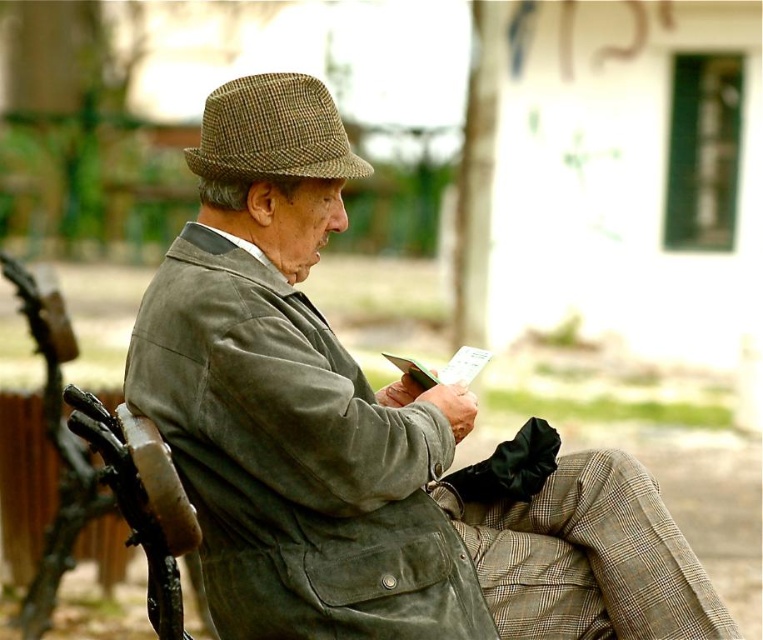
Question: Does matte green coat at center have a smaller size compared to brown checkered fedora at upper center?

Choices:
 (A) yes
 (B) no

Answer: (B)

Question: Where is matte green coat at center located in relation to brown checkered fedora at upper center in the image?

Choices:
 (A) left
 (B) right

Answer: (B)

Question: Which object is closer to the camera taking this photo?

Choices:
 (A) matte green coat at center
 (B) green corduroy trench coat at center
 (C) brown checkered fedora at upper center

Answer: (B)

Question: Which object is positioned closest to the brown checkered fedora at upper center?

Choices:
 (A) green corduroy trench coat at center
 (B) matte green coat at center

Answer: (A)

Question: Can you confirm if matte green coat at center is positioned below brown checkered fedora at upper center?

Choices:
 (A) yes
 (B) no

Answer: (A)

Question: Which point is closer to the camera?

Choices:
 (A) pos(314,340)
 (B) pos(216,97)
 (C) pos(414,630)

Answer: (C)